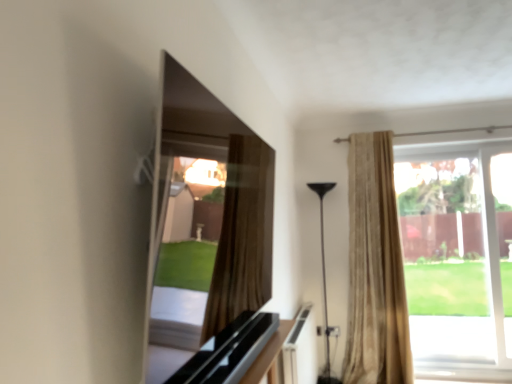
What are the coordinates of `empty space that is ontop of black glossy dresser at center` in the screenshot? It's located at (242, 334).